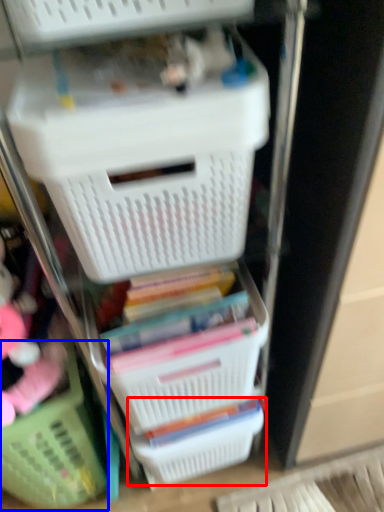
Question: Which point is further to the camera, basket (highlighted by a red box) or basket (highlighted by a blue box)?

Choices:
 (A) basket
 (B) basket

Answer: (A)